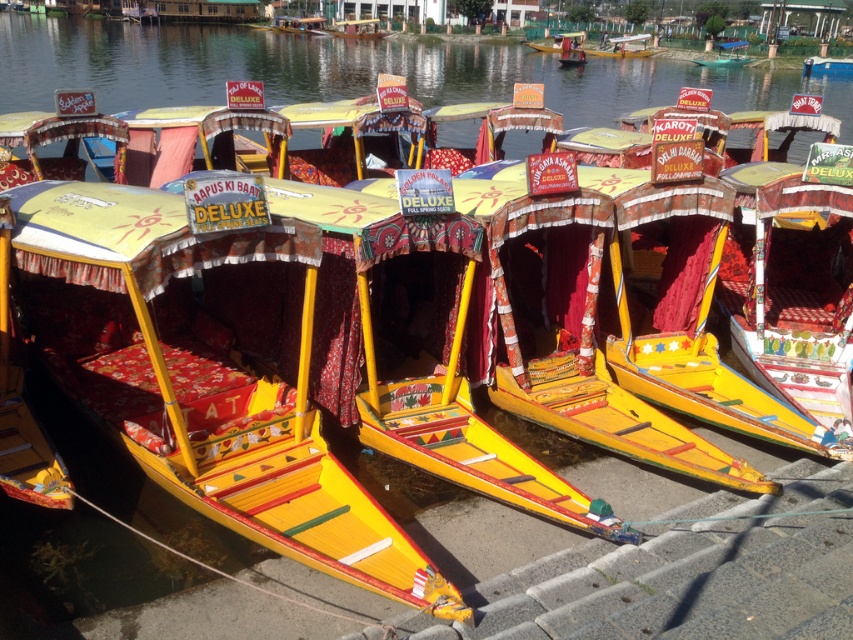
Which is in front, point (257, 492) or point (573, 44)?

Point (257, 492)

Does yellow painted wood boat at center have a smaller size compared to matte yellow boat at center?

Correct, yellow painted wood boat at center occupies less space than matte yellow boat at center.

Is point (210, 378) positioned in front of point (561, 44)?

That is True.

Image resolution: width=853 pixels, height=640 pixels. What are the coordinates of `yellow painted wood boat at center` in the screenshot? It's located at (202, 381).